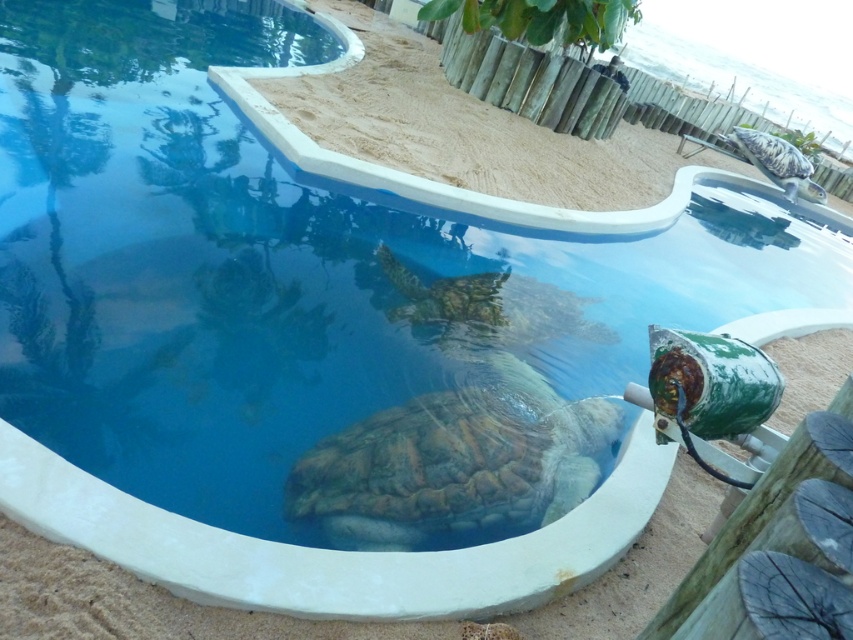
Is brown textured shell at center wider than textured brown tortoise at center?

No.

Is brown textured shell at center shorter than textured brown tortoise at center?

Indeed, brown textured shell at center has a lesser height compared to textured brown tortoise at center.

Describe the element at coordinates (454, 461) in the screenshot. The image size is (853, 640). I see `brown textured shell at center` at that location.

Locate an element on the screen. Image resolution: width=853 pixels, height=640 pixels. brown textured shell at center is located at coordinates (454, 461).

Does brown textured shell at center appear over green scaly tortoise at upper right?

Actually, brown textured shell at center is below green scaly tortoise at upper right.

Where is `brown textured shell at center`? This screenshot has height=640, width=853. brown textured shell at center is located at coordinates (454, 461).

Is textured brown tortoise at center wider than green scaly tortoise at upper right?

Indeed, textured brown tortoise at center has a greater width compared to green scaly tortoise at upper right.

Measure the distance between textured brown tortoise at center and green scaly tortoise at upper right.

textured brown tortoise at center and green scaly tortoise at upper right are 8.14 meters apart from each other.

Is point (555, 317) farther from camera compared to point (809, 195)?

No, (555, 317) is closer to viewer.

What are the coordinates of `textured brown tortoise at center` in the screenshot? It's located at (488, 307).